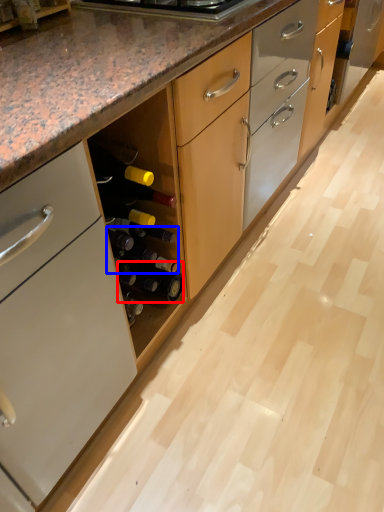
Question: Which object appears farthest to the camera in this image, beer bottle (highlighted by a red box) or beer bottle (highlighted by a blue box)?

Choices:
 (A) beer bottle
 (B) beer bottle

Answer: (A)